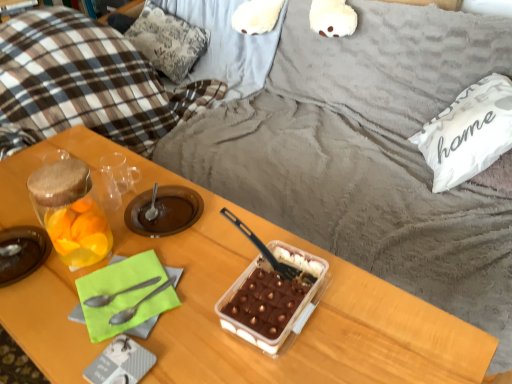
This screenshot has width=512, height=384. Identify the location of free location to the right of black plastic spoon at center, the third spoon from the left. (344, 283).